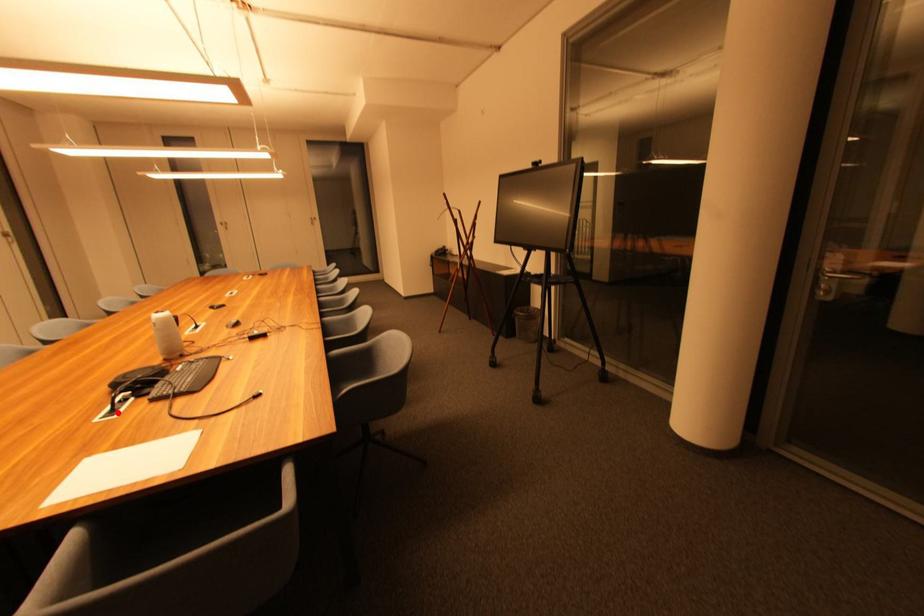
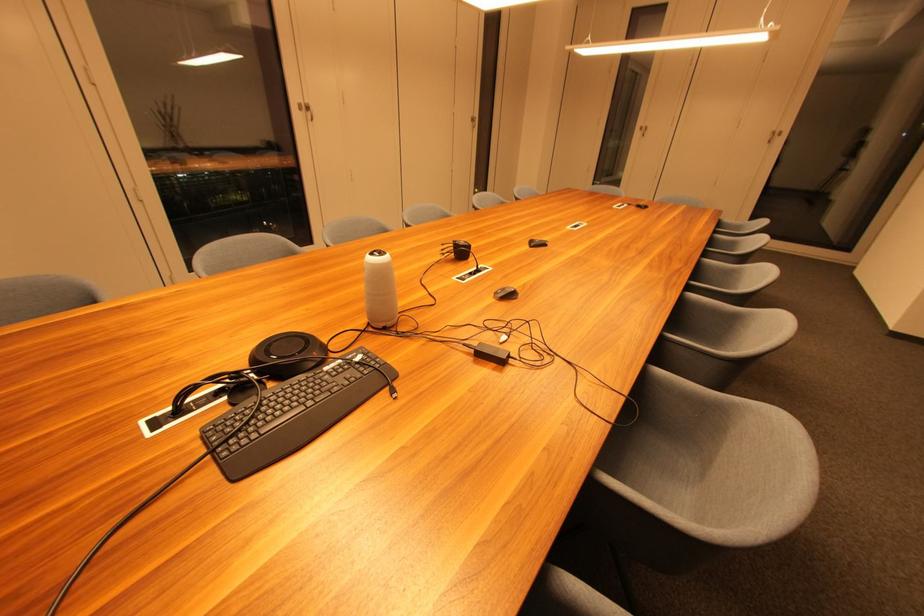
Where in the second image is the point corresponding to the highlighted location from the first image?

(185, 414)